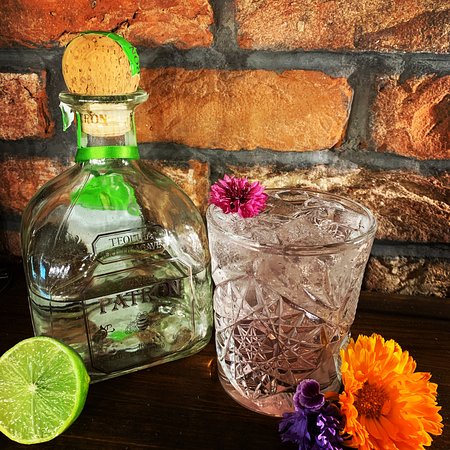
The image size is (450, 450). What are the coordinates of `wall` in the screenshot? It's located at (274, 116).